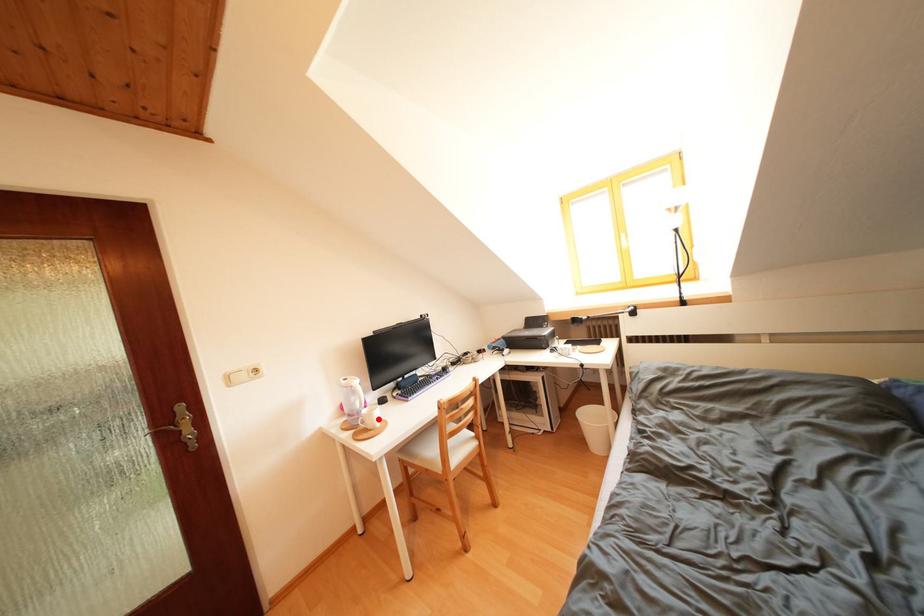
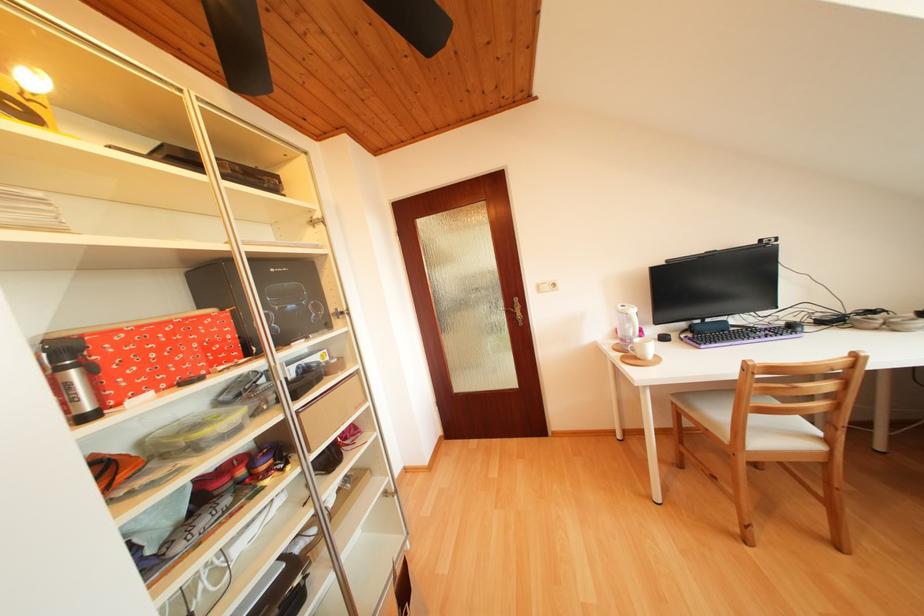
In the second image, find the point that corresponds to the highlighted location in the first image.

(650, 350)